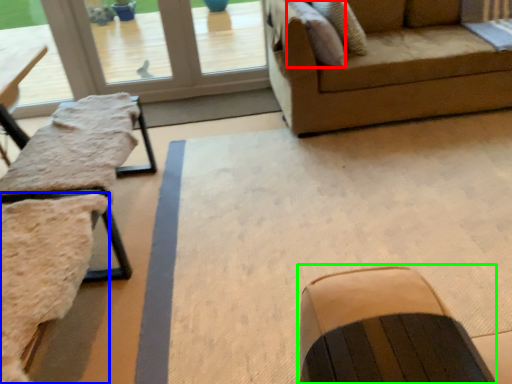
Question: Which is farther away from pillow (highlighted by a red box)? swivel chair (highlighted by a blue box) or rocking chair (highlighted by a green box)?

Choices:
 (A) swivel chair
 (B) rocking chair

Answer: (B)